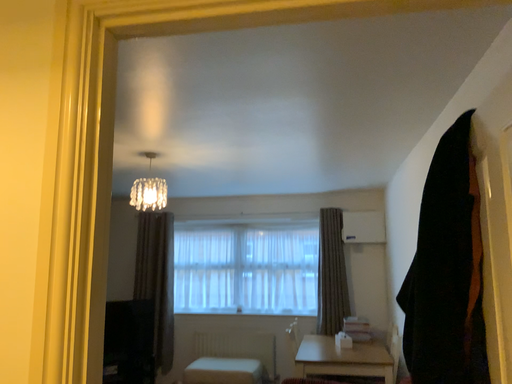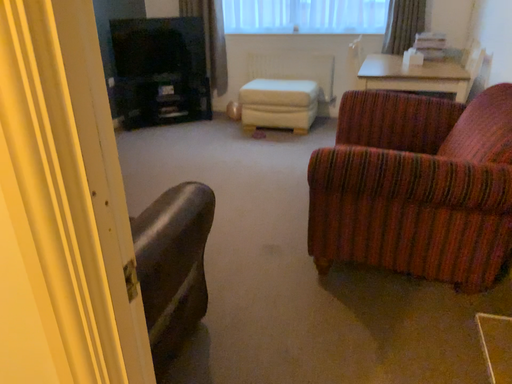
Question: How did the camera likely rotate when shooting the video?

Choices:
 (A) rotated downward
 (B) rotated upward

Answer: (A)